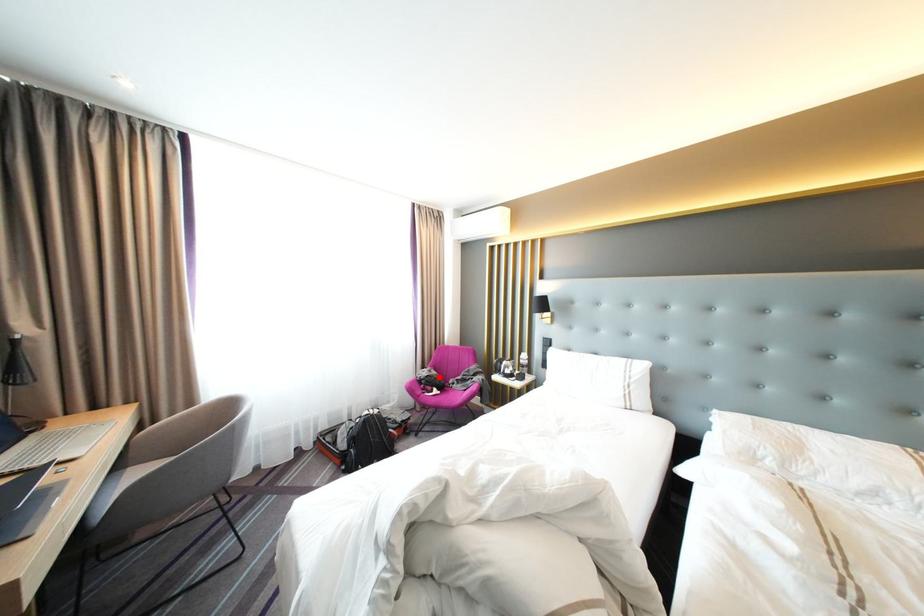
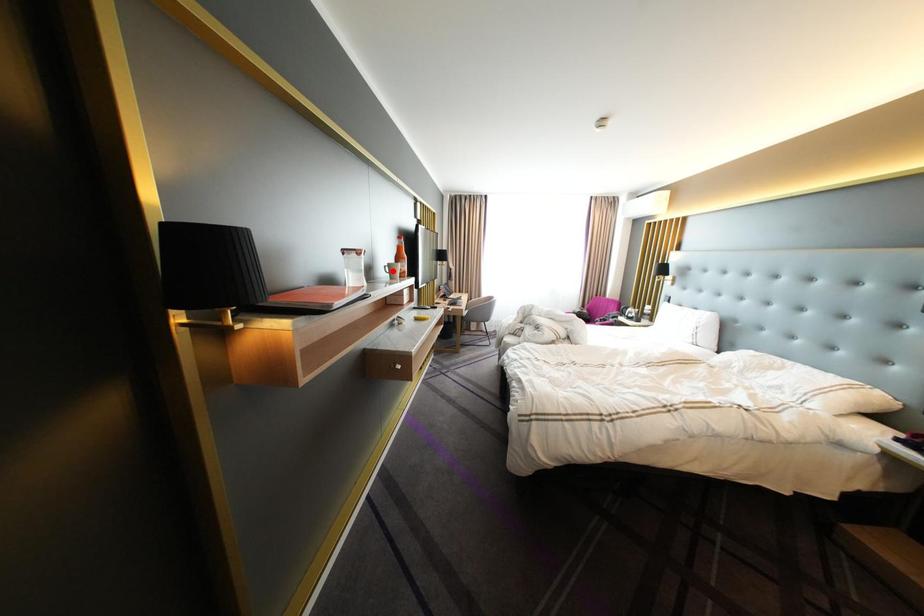
I am providing you with two images of the same scene from different viewpoints. A red point is marked on the first image and another point is marked on the second image. Do the highlighted points in image1 and image2 indicate the same real-world spot?

No